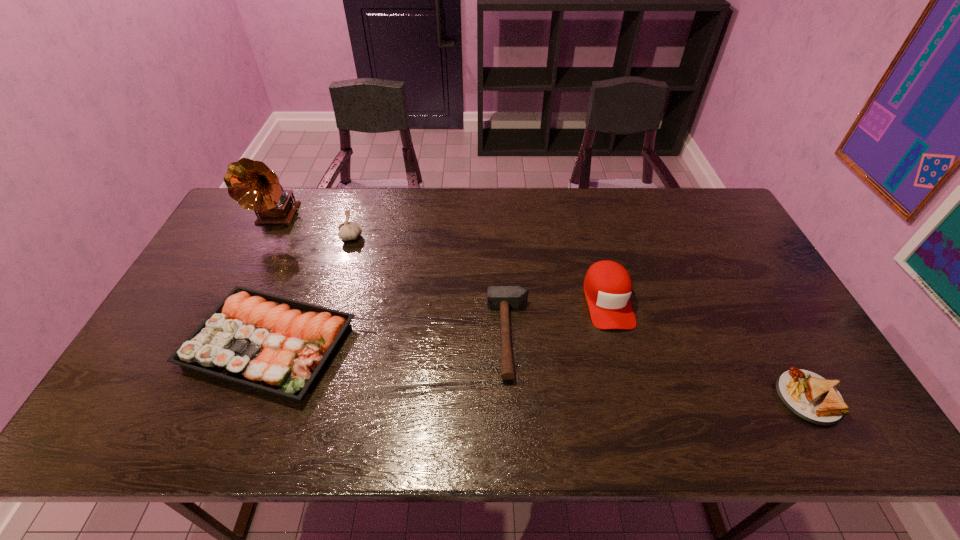
In the image, there is a desktop. What are the coordinates of `vacant space at the far right corner` in the screenshot? It's located at (695, 224).

Locate an element on the screen. This screenshot has width=960, height=540. vacant area that lies between the garlic and the platter is located at coordinates (310, 291).

Find the location of a particular element. free area in between the rightmost object and the platter is located at coordinates (539, 371).

Where is `free area in between the tallest object and the shortest object`? This screenshot has height=540, width=960. free area in between the tallest object and the shortest object is located at coordinates (542, 307).

The height and width of the screenshot is (540, 960). I want to click on empty space that is in between the garlic and the baseball cap, so click(479, 268).

This screenshot has width=960, height=540. What are the coordinates of `free spot between the fifth object from left to right and the shortest object` in the screenshot? It's located at (708, 349).

Locate an element on the screen. The image size is (960, 540). blank region between the baseball cap and the rightmost object is located at coordinates (708, 349).

I want to click on free space between the platter and the third object from right to left, so click(389, 340).

You are a GUI agent. You are given a task and a screenshot of the screen. Output one action in this format:
    pyautogui.click(x=<x>, y=<y>)
    Task: Click on the vacant area that lies between the sandwich and the garlic
    The image size is (960, 540).
    Given the screenshot: What is the action you would take?
    pyautogui.click(x=580, y=318)

At what (x,y) coordinates should I click in order to perform the action: click on free area in between the rightmost object and the platter. Please return your answer as a coordinate pair (x, y). Looking at the image, I should click on (539, 371).